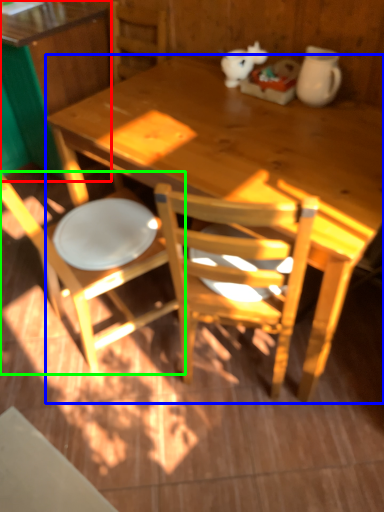
Question: Based on their relative distances, which object is nearer to desk (highlighted by a red box)? Choose from desk (highlighted by a blue box) and chair (highlighted by a green box).

Choices:
 (A) desk
 (B) chair

Answer: (A)